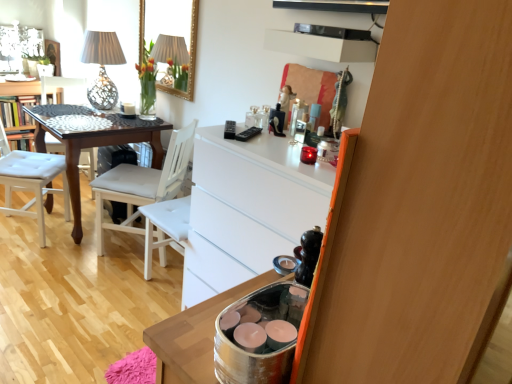
Question: Is white glossy vanity at upper left turned away from silver metallic container at lower right?

Choices:
 (A) no
 (B) yes

Answer: (A)

Question: Considering the relative sizes of white glossy vanity at upper left and silver metallic container at lower right in the image provided, is white glossy vanity at upper left thinner than silver metallic container at lower right?

Choices:
 (A) yes
 (B) no

Answer: (B)

Question: Considering the relative sizes of white glossy vanity at upper left and silver metallic container at lower right in the image provided, is white glossy vanity at upper left shorter than silver metallic container at lower right?

Choices:
 (A) no
 (B) yes

Answer: (A)

Question: Is the position of white glossy vanity at upper left less distant than that of silver metallic container at lower right?

Choices:
 (A) no
 (B) yes

Answer: (A)

Question: From the image's perspective, does white glossy vanity at upper left appear lower than silver metallic container at lower right?

Choices:
 (A) yes
 (B) no

Answer: (B)

Question: Is white glossy vanity at upper left in contact with silver metallic container at lower right?

Choices:
 (A) no
 (B) yes

Answer: (A)

Question: From the image's perspective, is wooden dresser at right beneath dark wood table at left?

Choices:
 (A) yes
 (B) no

Answer: (A)

Question: Is wooden dresser at right facing away from dark wood table at left?

Choices:
 (A) no
 (B) yes

Answer: (A)

Question: Is wooden dresser at right located outside dark wood table at left?

Choices:
 (A) yes
 (B) no

Answer: (A)

Question: Can you confirm if wooden dresser at right is taller than dark wood table at left?

Choices:
 (A) no
 (B) yes

Answer: (A)

Question: Considering the relative sizes of wooden dresser at right and dark wood table at left in the image provided, is wooden dresser at right bigger than dark wood table at left?

Choices:
 (A) no
 (B) yes

Answer: (A)

Question: Is the position of wooden dresser at right more distant than that of dark wood table at left?

Choices:
 (A) yes
 (B) no

Answer: (B)

Question: Is white glossy vanity at upper left taller than matte white lampshade at upper left?

Choices:
 (A) yes
 (B) no

Answer: (A)